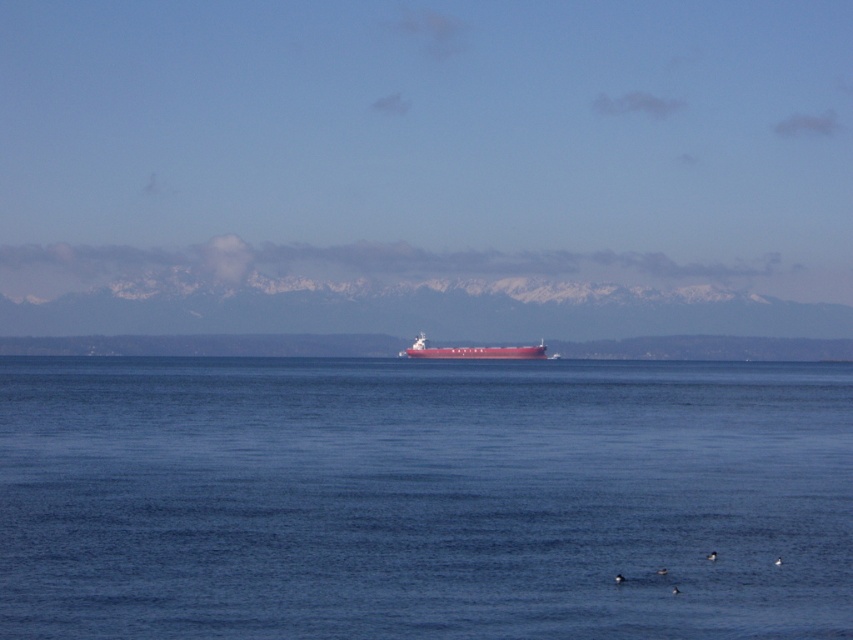
Question: Which of the following is the farthest from the observer?

Choices:
 (A) (734, 396)
 (B) (444, 348)

Answer: (B)

Question: Which point is closer to the camera?

Choices:
 (A) (451, 348)
 (B) (206, 368)

Answer: (B)

Question: Is blue smooth water at center bigger than matte red ship at center?

Choices:
 (A) yes
 (B) no

Answer: (A)

Question: Does blue smooth water at center appear on the right side of matte red ship at center?

Choices:
 (A) no
 (B) yes

Answer: (B)

Question: Can you confirm if blue smooth water at center is smaller than matte red ship at center?

Choices:
 (A) no
 (B) yes

Answer: (A)